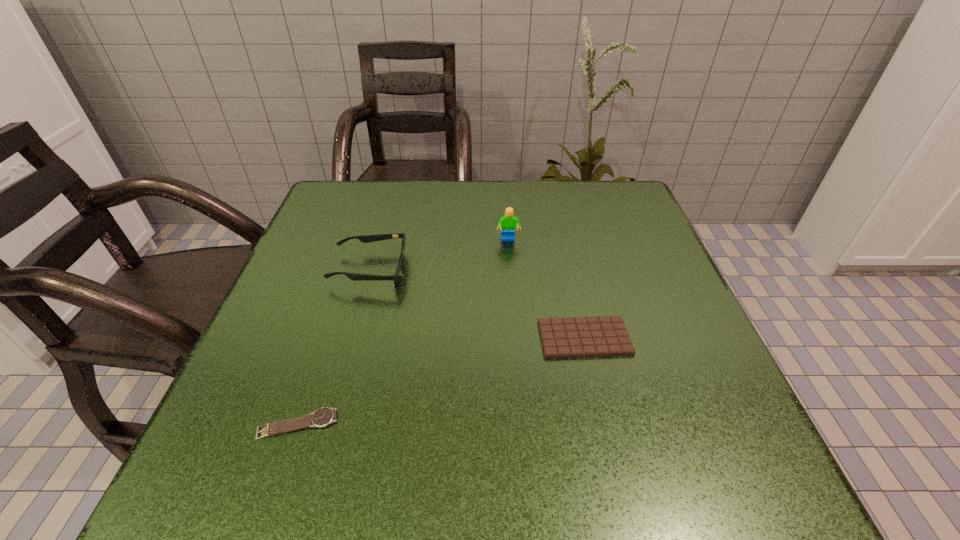
Image resolution: width=960 pixels, height=540 pixels. Identify the location of the tallest object. (508, 222).

Find the location of a particular element. the farthest object is located at coordinates (508, 222).

Where is `sunglasses`? This screenshot has height=540, width=960. sunglasses is located at coordinates (378, 237).

At what (x,y) coordinates should I click in order to perform the action: click on the second tallest object. Please return your answer as a coordinate pair (x, y). The height and width of the screenshot is (540, 960). Looking at the image, I should click on (378, 237).

Where is `chocolate bar`? Image resolution: width=960 pixels, height=540 pixels. chocolate bar is located at coordinates (566, 337).

Image resolution: width=960 pixels, height=540 pixels. Identify the location of the second nearest object. (566, 337).

Where is `the shortest object`? Image resolution: width=960 pixels, height=540 pixels. the shortest object is located at coordinates (324, 416).

Image resolution: width=960 pixels, height=540 pixels. In order to click on the nearest object in this screenshot , I will do [324, 416].

At what (x,y) coordinates should I click in order to perform the action: click on vacant space located 0.360m on the face of the farthest object. Please return your answer as a coordinate pair (x, y). Looking at the image, I should click on (518, 374).

I want to click on free spot located on the front-facing side of the second farthest object, so click(481, 269).